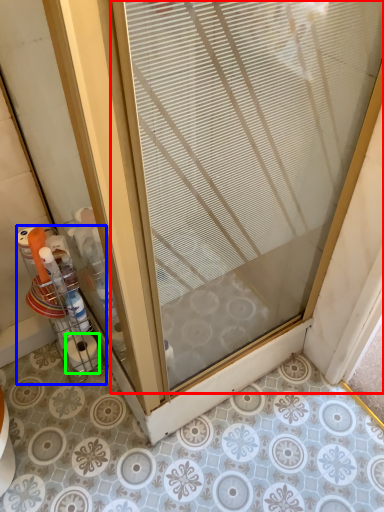
Question: Considering the real-world distances, which object is closest to door (highlighted by a red box)? glass box (highlighted by a blue box) or toilet paper (highlighted by a green box).

Choices:
 (A) glass box
 (B) toilet paper

Answer: (A)